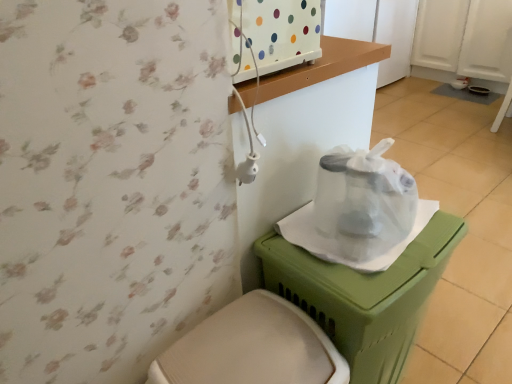
Image resolution: width=512 pixels, height=384 pixels. Describe the element at coordinates (364, 295) in the screenshot. I see `green plastic potty at lower right` at that location.

The image size is (512, 384). Identify the location of transparent plastic bag at center. (360, 211).

Identify the location of white plastic toilet at lower center. Image resolution: width=512 pixels, height=384 pixels. (252, 347).

The height and width of the screenshot is (384, 512). I want to click on green plastic potty at lower right, so click(364, 295).

Is green plastic potty at lower right outside of transparent plastic bag at center?

Indeed, green plastic potty at lower right is completely outside transparent plastic bag at center.

The image size is (512, 384). Identify the location of paper bag on the left of green plastic potty at lower right. (360, 211).

From the picture: Is green plastic potty at lower right looking in the opposite direction of transparent plastic bag at center?

No.

From a real-world perspective, who is located lower, green plastic potty at lower right or white plastic toilet at lower center?

white plastic toilet at lower center is physically lower.

Between point (424, 244) and point (298, 311), which one is positioned in front?

The point (298, 311) is closer.

Is green plastic potty at lower right in front of or behind white plastic toilet at lower center in the image?

green plastic potty at lower right is behind white plastic toilet at lower center.

Is green plastic potty at lower right far from white plastic toilet at lower center?

green plastic potty at lower right is near white plastic toilet at lower center, not far away.

Between transparent plastic bag at center and green plastic potty at lower right, which one is positioned behind?

transparent plastic bag at center is more distant.

Between point (420, 228) and point (447, 257), which one is positioned behind?

The point (420, 228) is more distant.

Looking at the image, does transparent plastic bag at center seem bigger or smaller compared to green plastic potty at lower right?

Clearly, transparent plastic bag at center is smaller in size than green plastic potty at lower right.

Locate an element on the screen. This screenshot has width=512, height=384. paper bag behind the green plastic potty at lower right is located at coordinates point(360,211).

Which of these two, transparent plastic bag at center or white plastic toilet at lower center, is thinner?

transparent plastic bag at center is thinner.

Can white plastic toilet at lower center be found inside transparent plastic bag at center?

No, transparent plastic bag at center does not contain white plastic toilet at lower center.

Is transparent plastic bag at center shorter than white plastic toilet at lower center?

Correct, transparent plastic bag at center is not as tall as white plastic toilet at lower center.

Based on the photo, between white plastic toilet at lower center and transparent plastic bag at center, which one has more height?

white plastic toilet at lower center is taller.

From a real-world perspective, which object stands above the other?

In real-world perspective, transparent plastic bag at center is above.

Is white plastic toilet at lower center facing away from transparent plastic bag at center?

No.

Looking at this image, can you confirm if white plastic toilet at lower center is wider than transparent plastic bag at center?

Yes, white plastic toilet at lower center is wider than transparent plastic bag at center.

Is white plastic toilet at lower center positioned before green plastic potty at lower right?

Yes, white plastic toilet at lower center is in front of green plastic potty at lower right.

From a real-world perspective, is white plastic toilet at lower center physically above green plastic potty at lower right?

No, from a real-world perspective, white plastic toilet at lower center is not over green plastic potty at lower right

Is white plastic toilet at lower center taller than green plastic potty at lower right?

In fact, white plastic toilet at lower center may be shorter than green plastic potty at lower right.

Locate an element on the screen. potty in front of the transparent plastic bag at center is located at coordinates (364, 295).

Locate an element on the screen. This screenshot has width=512, height=384. potty located on the right of white plastic toilet at lower center is located at coordinates (364, 295).

Considering their positions, is transparent plastic bag at center positioned closer to green plastic potty at lower right than white plastic toilet at lower center?

transparent plastic bag at center lies closer to green plastic potty at lower right than the other object.

Based on their spatial positions, is white plastic toilet at lower center or green plastic potty at lower right further from transparent plastic bag at center?

white plastic toilet at lower center is further to transparent plastic bag at center.

Considering their positions, is green plastic potty at lower right positioned further to white plastic toilet at lower center than transparent plastic bag at center?

transparent plastic bag at center.

Looking at the image, which one is located further to white plastic toilet at lower center, transparent plastic bag at center or green plastic potty at lower right?

Among the two, transparent plastic bag at center is located further to white plastic toilet at lower center.

Considering their positions, is green plastic potty at lower right positioned further to transparent plastic bag at center than white plastic toilet at lower center?

white plastic toilet at lower center is further to transparent plastic bag at center.

From the image, which object appears to be farther from green plastic potty at lower right, white plastic toilet at lower center or transparent plastic bag at center?

white plastic toilet at lower center.

Identify the location of potty between transparent plastic bag at center and white plastic toilet at lower center from top to bottom. (364, 295).